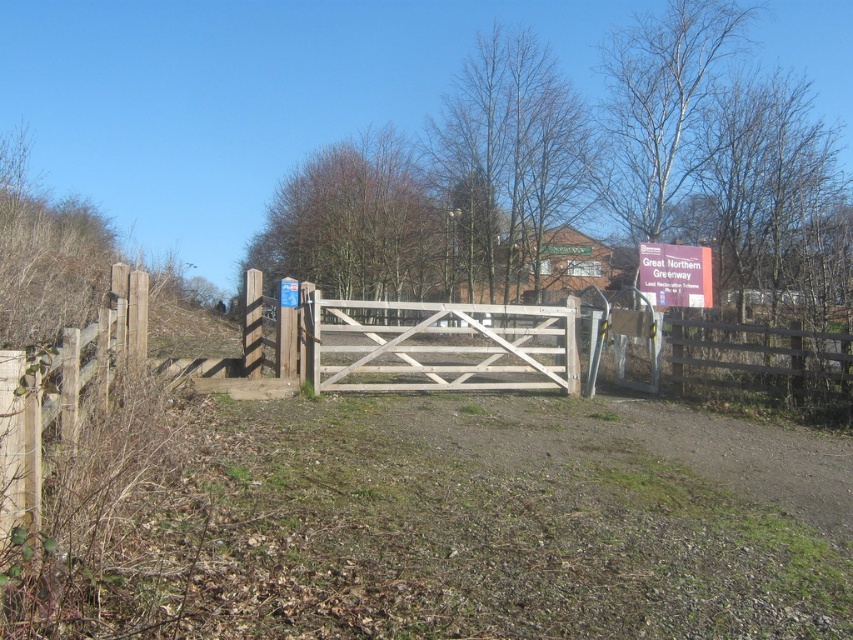
You are a delivery person trying to drive a van through the white wooden gate at center. The van is 2 meters wide. There is a purple matte sign at upper right nearby. Can you determine if the gate is wide enough for your van?

The white wooden gate at center might be wider than purple matte sign at upper right. Since the sign is not mentioned to have a width, we cannot confirm if the gate is wide enough for the van. Please check the actual dimensions or look for other indicators of the gate width.

Based on the photo, you are standing at the point with coordinates [439,346] in the rural scene. What object are you directly in front of?

The point [439,346] corresponds to the white wooden gate at center, so you are directly in front of the white wooden gate at center.

You are a delivery person trying to locate the entrance to a property. You see the white wooden gate at center and the purple matte sign at upper right. According to the scene, which object is positioned higher up in the image?

The purple matte sign at upper right is positioned higher up in the image than the white wooden gate at center.